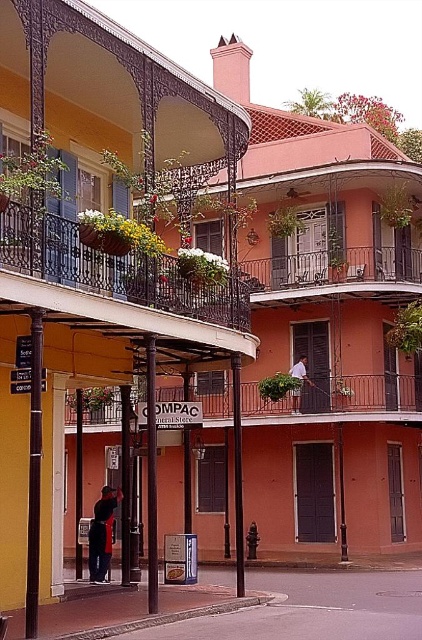
Can you confirm if rustic wood balcony at center is taller than white cotton shirt at center?

Yes.

Can you confirm if rustic wood balcony at center is positioned below white cotton shirt at center?

Yes, rustic wood balcony at center is below white cotton shirt at center.

At what (x,y) coordinates should I click in order to perform the action: click on rustic wood balcony at center. Please return your answer as a coordinate pair (x, y). Looking at the image, I should click on (362, 396).

Is matte black wrought iron balcony at upper left further to the viewer compared to rustic wood balcony at center?

No, it is in front of rustic wood balcony at center.

Is point (138, 56) positioned behind point (203, 397)?

No, it is in front of (203, 397).

Is point (86, 81) more distant than point (405, 401)?

No, it is in front of (405, 401).

Where is `matte black wrought iron balcony at upper left`? Image resolution: width=422 pixels, height=640 pixels. matte black wrought iron balcony at upper left is located at coordinates (105, 99).

Between metallic pole at center and brown wooden pillar at center, which one has less height?

metallic pole at center

From the picture: Who is more forward, (154,470) or (240,548)?

Point (154,470) is more forward.

Where is `metallic pole at center`? Image resolution: width=422 pixels, height=640 pixels. metallic pole at center is located at coordinates (151, 474).